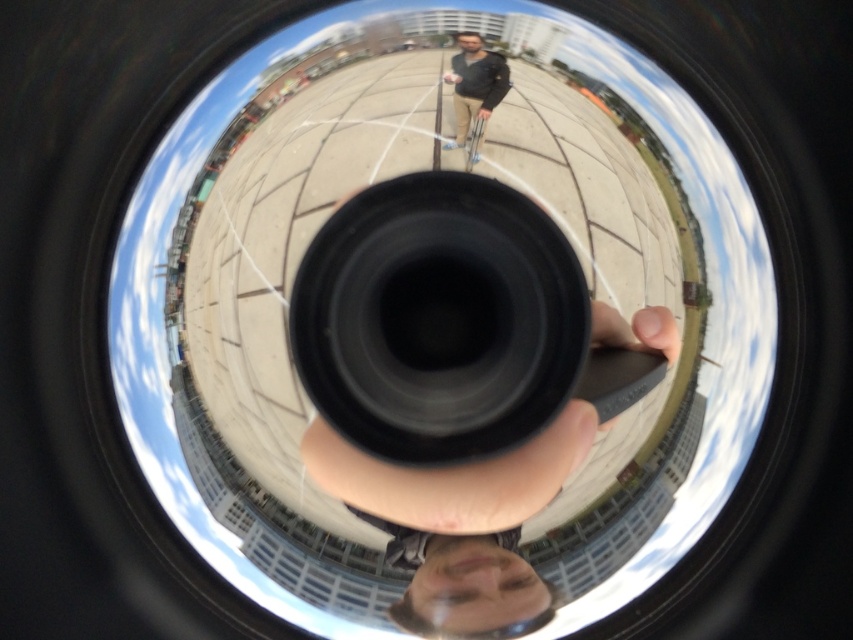
Question: Is black matte hand at center wider than dark gray jacket at center?

Choices:
 (A) no
 (B) yes

Answer: (B)

Question: Which of the following is the closest to the observer?

Choices:
 (A) (479, 67)
 (B) (569, 404)

Answer: (B)

Question: Can you confirm if black matte hand at center is positioned to the right of dark gray jacket at center?

Choices:
 (A) yes
 (B) no

Answer: (A)

Question: Can you confirm if black matte hand at center is smaller than dark gray jacket at center?

Choices:
 (A) no
 (B) yes

Answer: (A)